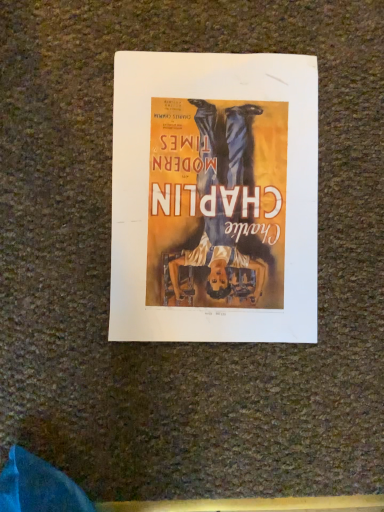
At what (x,y) coordinates should I click in order to perform the action: click on matte paper poster at center. Please return your answer as a coordinate pair (x, y). Looking at the image, I should click on (214, 198).

This screenshot has width=384, height=512. What do you see at coordinates (214, 198) in the screenshot?
I see `matte paper poster at center` at bounding box center [214, 198].

At what (x,y) coordinates should I click in order to perform the action: click on matte paper poster at center. Please return your answer as a coordinate pair (x, y). Looking at the image, I should click on (214, 198).